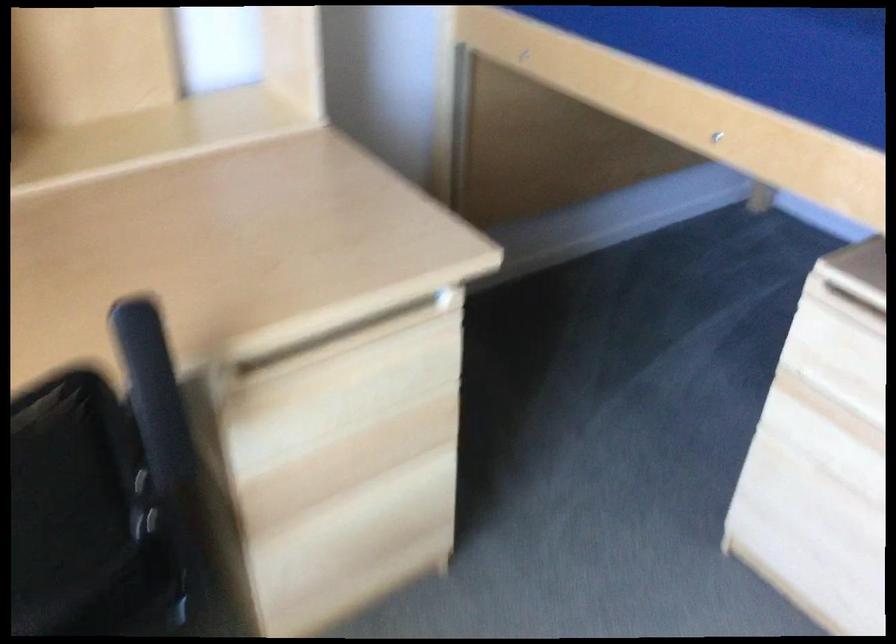
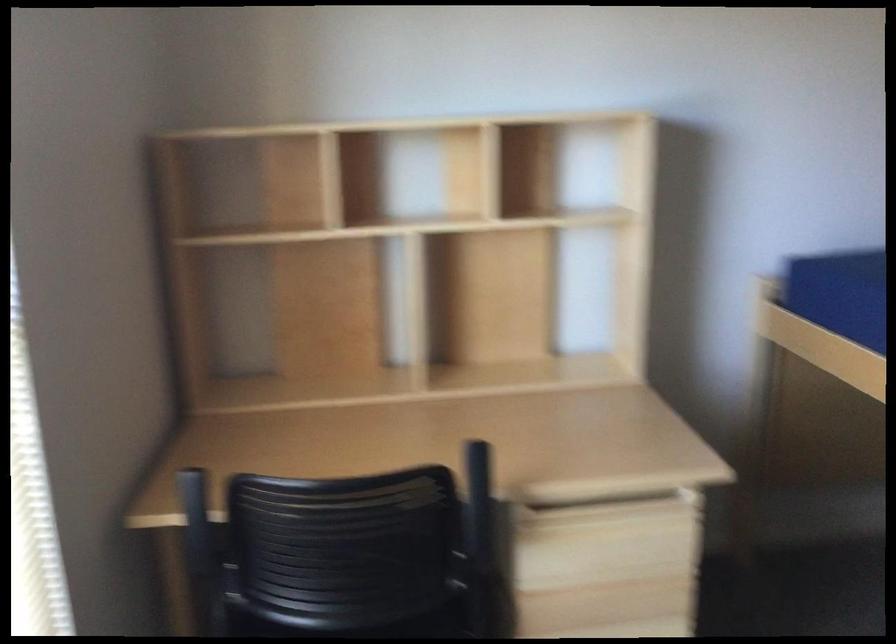
In the second image, find the point that corresponds to [371,346] in the first image.

(616, 520)